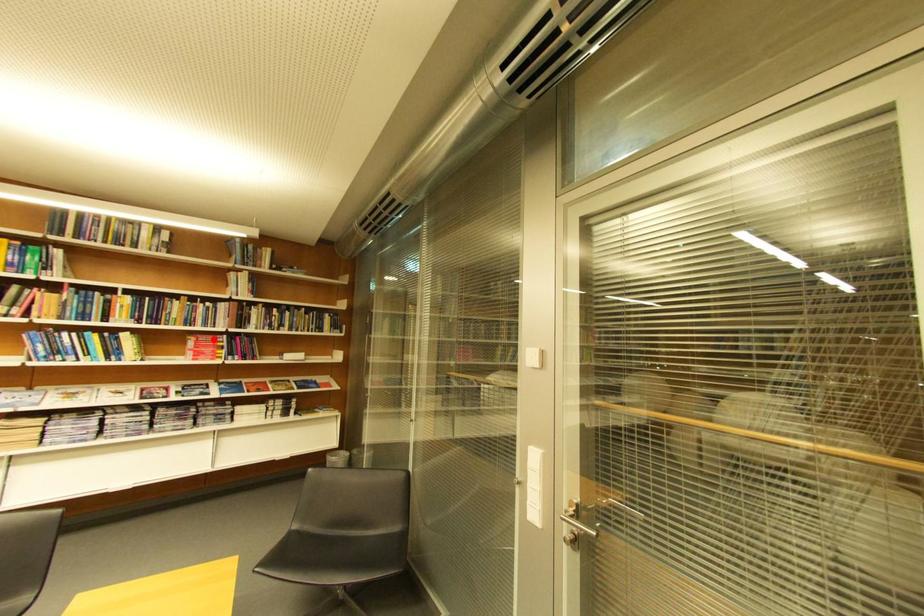
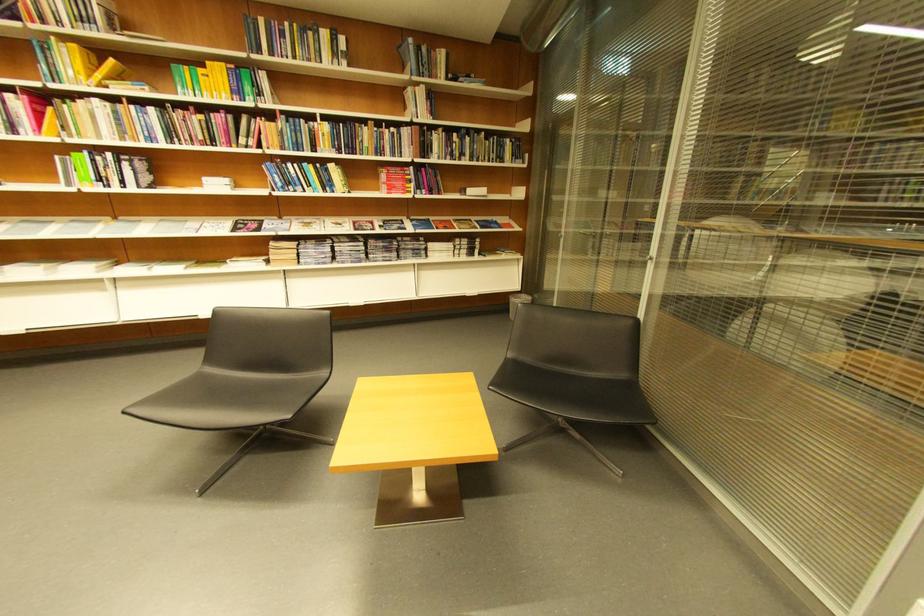
Question: I am providing you with two images of the same scene from different viewpoints. Given a red point in image1, look at the same physical point in image2. Is it:

Choices:
 (A) Closer to the viewpoint
 (B) Farther from the viewpoint

Answer: (A)